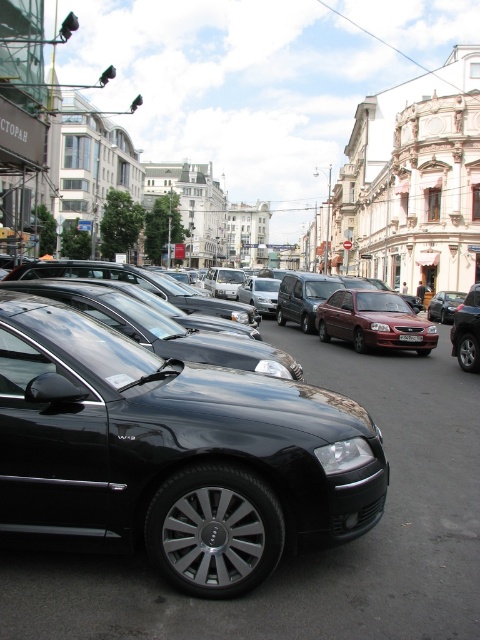
You are a delivery person trying to park your van which is 2 meters wide. You see the glossy black car at center and the white plastic license plate at center in the parking spot. Can your van fit in the parking spot based on the width?

The glossy black car at center is wider than the white plastic license plate at center. Since the car is wider than the license plate, the parking spot might be sized for vehicles up to the car width. However, since your van is 2 meters wide, and the car is wider than the license plate but we don not have exact measurements, it is uncertain. Please check the parking spot dimensions before attempting to park.

You are a delivery driver who needs to park your car in this street scene. You notice the glossy black car at center and the white plastic license plate at center. Which object is bigger in size?

The glossy black car at center is larger in size compared to the white plastic license plate at center.

You are a parking attendant who needs to guide a driver to park their car. The driver wants to park their car so that the license plate is on the right side of the car. Based on the image, is the current position of the glossy black car at center and the white plastic license plate at center aligned correctly for this requirement?

The glossy black car at center is to the left of the white plastic license plate at center, meaning the license plate is on the right side of the car, so the current position is correctly aligned.